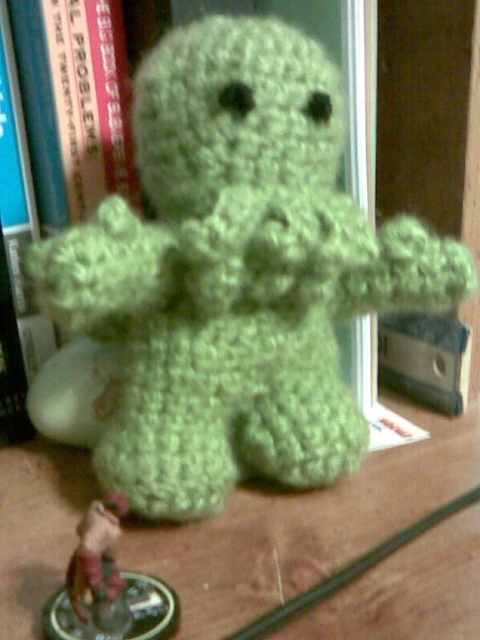
Question: Which point is farther to the camera?

Choices:
 (A) green yarn stuffed toy at center
 (B) metallic red figurine at lower left

Answer: (A)

Question: Does green yarn stuffed toy at center lie behind metallic red figurine at lower left?

Choices:
 (A) no
 (B) yes

Answer: (B)

Question: Is green yarn stuffed toy at center below metallic red figurine at lower left?

Choices:
 (A) yes
 (B) no

Answer: (B)

Question: Is green yarn stuffed toy at center thinner than metallic red figurine at lower left?

Choices:
 (A) yes
 (B) no

Answer: (B)

Question: Which of the following is the farthest from the observer?

Choices:
 (A) (70, 557)
 (B) (71, 122)

Answer: (B)

Question: Which object is closer to the camera taking this photo?

Choices:
 (A) green yarn stuffed toy at center
 (B) metallic red figurine at lower left

Answer: (B)